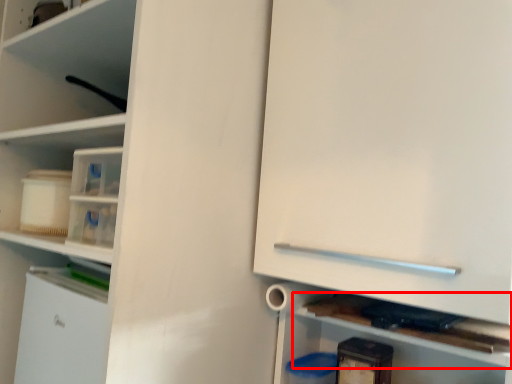
Question: Considering the relative positions of cabinet (annotated by the red box) and cabinetry in the image provided, where is cabinet (annotated by the red box) located with respect to the staircase?

Choices:
 (A) right
 (B) left

Answer: (B)